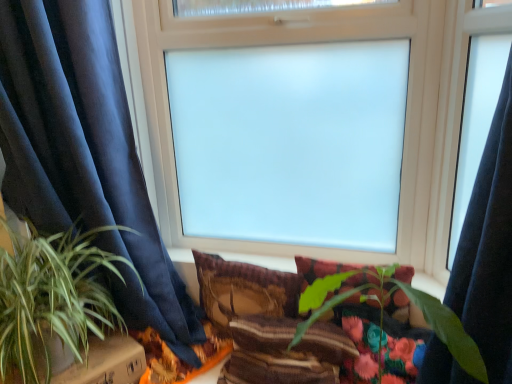
Question: In which direction should I rotate to look at textured brown pillow at center, the 3th pillow viewed from the right?

Choices:
 (A) right
 (B) left

Answer: (B)

Question: From the image's perspective, is green leafy plant at left, marked as the 1th houseplant in a left-to-right arrangement, on top of plush fabric pillow at center, which is the third pillow from left to right?

Choices:
 (A) no
 (B) yes

Answer: (B)

Question: Is green leafy plant at left, marked as the 1th houseplant in a left-to-right arrangement, not near plush fabric pillow at center, which is counted as the first pillow, starting from the right?

Choices:
 (A) yes
 (B) no

Answer: (B)

Question: Can you confirm if green leafy plant at left, marked as the 1th houseplant in a left-to-right arrangement, is thinner than plush fabric pillow at center, which is counted as the first pillow, starting from the right?

Choices:
 (A) yes
 (B) no

Answer: (B)

Question: Can you confirm if green leafy plant at left, marked as the 2th houseplant in a right-to-left arrangement, is smaller than plush fabric pillow at center, which is counted as the first pillow, starting from the right?

Choices:
 (A) no
 (B) yes

Answer: (A)

Question: Is green leafy plant at left, marked as the 1th houseplant in a left-to-right arrangement, to the left of plush fabric pillow at center, which is counted as the first pillow, starting from the right, from the viewer's perspective?

Choices:
 (A) yes
 (B) no

Answer: (A)

Question: From a real-world perspective, is green leafy plant at left, marked as the 1th houseplant in a left-to-right arrangement, located beneath plush fabric pillow at center, which is the third pillow from left to right?

Choices:
 (A) yes
 (B) no

Answer: (B)

Question: From a real-world perspective, is plush fabric pillow at center, which is counted as the first pillow, starting from the right, positioned over cardboard box at lower left based on gravity?

Choices:
 (A) yes
 (B) no

Answer: (A)

Question: Considering the relative sizes of plush fabric pillow at center, which is counted as the first pillow, starting from the right, and cardboard box at lower left in the image provided, is plush fabric pillow at center, which is counted as the first pillow, starting from the right, taller than cardboard box at lower left?

Choices:
 (A) no
 (B) yes

Answer: (B)

Question: Is plush fabric pillow at center, which is the third pillow from left to right, shorter than cardboard box at lower left?

Choices:
 (A) yes
 (B) no

Answer: (B)

Question: From the image's perspective, is plush fabric pillow at center, which is the third pillow from left to right, located beneath cardboard box at lower left?

Choices:
 (A) no
 (B) yes

Answer: (A)

Question: Considering the relative sizes of plush fabric pillow at center, which is counted as the first pillow, starting from the right, and cardboard box at lower left in the image provided, is plush fabric pillow at center, which is counted as the first pillow, starting from the right, wider than cardboard box at lower left?

Choices:
 (A) yes
 (B) no

Answer: (B)

Question: Is the position of plush fabric pillow at center, which is counted as the first pillow, starting from the right, more distant than that of cardboard box at lower left?

Choices:
 (A) no
 (B) yes

Answer: (B)

Question: Considering the relative sizes of plush fabric pillow at center, which is the third pillow from left to right, and frosted glass window at center in the image provided, is plush fabric pillow at center, which is the third pillow from left to right, thinner than frosted glass window at center?

Choices:
 (A) yes
 (B) no

Answer: (A)